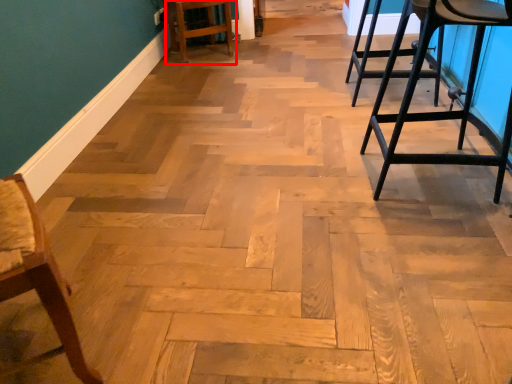
Question: In this image, where is bar stool (annotated by the red box) located relative to chair?

Choices:
 (A) right
 (B) left

Answer: (A)